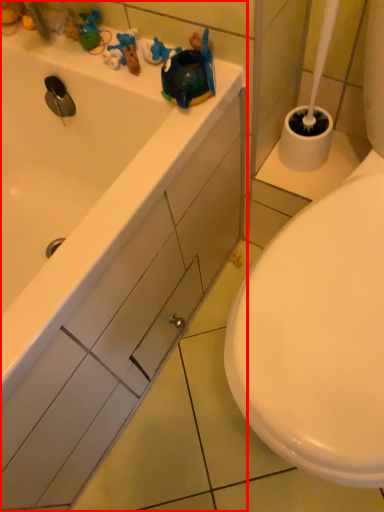
Question: From the image, what is the correct spatial relationship of bathtub (annotated by the red box) in relation to drawer?

Choices:
 (A) right
 (B) left

Answer: (B)